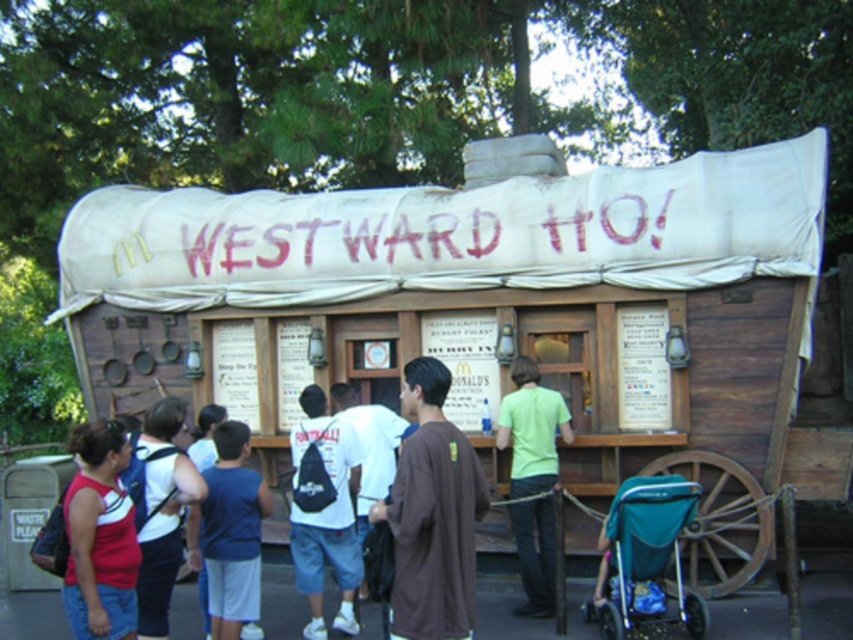
Question: In this image, where is brown cotton shirt at center located relative to white matte backpack at center?

Choices:
 (A) right
 (B) left

Answer: (A)

Question: Can you confirm if brown cotton shirt at center is bigger than light green t-shirt at center?

Choices:
 (A) no
 (B) yes

Answer: (A)

Question: Is brown cotton shirt at center in front of white matte backpack at center?

Choices:
 (A) no
 (B) yes

Answer: (B)

Question: Among these points, which one is farthest from the camera?

Choices:
 (A) (337, 536)
 (B) (99, 472)
 (C) (461, 572)

Answer: (A)

Question: Which point is farther to the camera?

Choices:
 (A) white matte backpack at center
 (B) white canvas canopy at center
 (C) blue fabric shirt at lower left

Answer: (B)

Question: Among these objects, which one is farthest from the camera?

Choices:
 (A) white fabric backpack at center
 (B) teal fabric stroller at lower right
 (C) blue fabric shirt at lower left

Answer: (B)